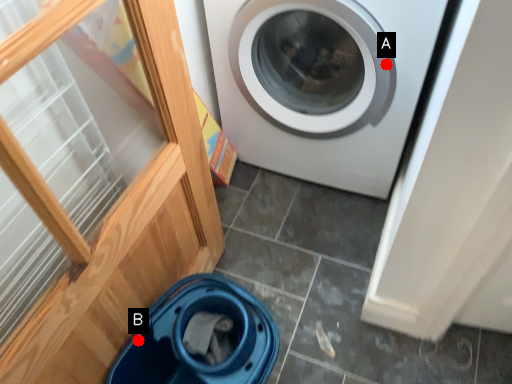
Question: Two points are circled on the image, labeled by A and B beside each circle. Which of the following is the farthest from the observer?

Choices:
 (A) A is further
 (B) B is further

Answer: (A)